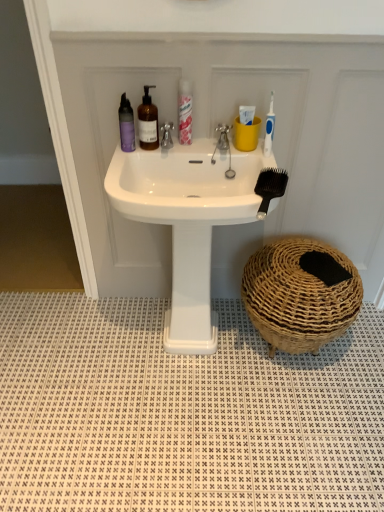
At what (x,y) coordinates should I click in order to perform the action: click on empty space that is ontop of brown woven basket at lower right. Please return your answer as a coordinate pair (x, y). Looking at the image, I should click on (307, 266).